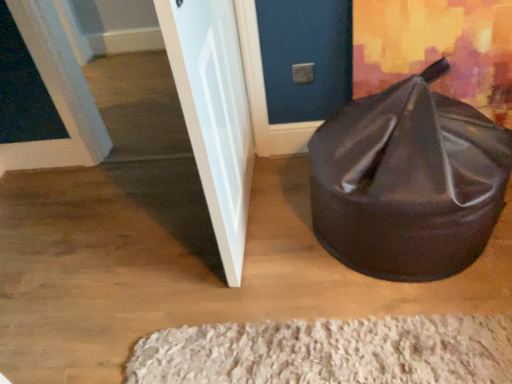
Where is `vacant area that is in front of white glossy door at left, the second door from the left`? This screenshot has width=512, height=384. vacant area that is in front of white glossy door at left, the second door from the left is located at coordinates (247, 283).